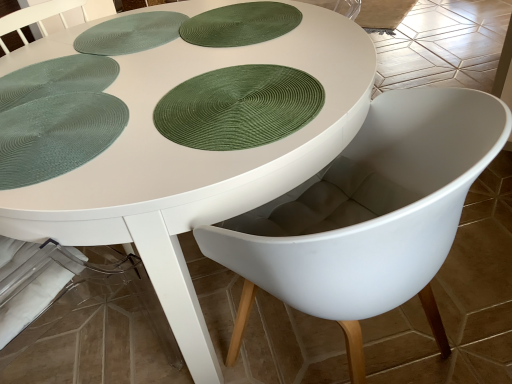
Locate an element on the screen. The width and height of the screenshot is (512, 384). free point below green textured placemat at upper center, arranged as the 4th paper plate when ordered from the bottom (from a real-world perspective) is located at coordinates (242, 32).